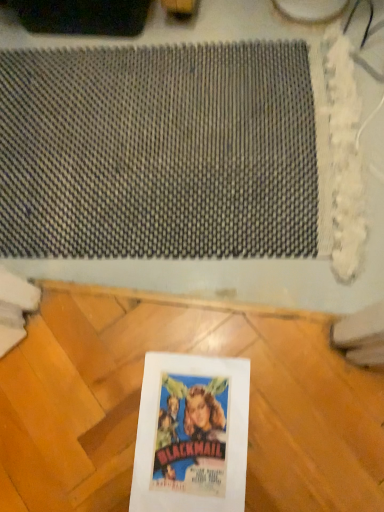
Question: Relative to textured gray mat at upper center, is white paper at center in front or behind?

Choices:
 (A) behind
 (B) front

Answer: (B)

Question: Choose the correct answer: Is white paper at center inside textured gray mat at upper center or outside it?

Choices:
 (A) inside
 (B) outside

Answer: (B)

Question: Considering the positions of point pos(152,378) and point pos(130,257), is point pos(152,378) closer or farther from the camera than point pos(130,257)?

Choices:
 (A) closer
 (B) farther

Answer: (A)

Question: Is textured gray mat at upper center in front of or behind white paper at center in the image?

Choices:
 (A) behind
 (B) front

Answer: (A)

Question: Which is correct: textured gray mat at upper center is inside white paper at center, or outside of it?

Choices:
 (A) inside
 (B) outside

Answer: (B)

Question: From the image's perspective, is textured gray mat at upper center above or below white paper at center?

Choices:
 (A) above
 (B) below

Answer: (A)

Question: From a real-world perspective, is textured gray mat at upper center physically located above or below white paper at center?

Choices:
 (A) below
 (B) above

Answer: (A)